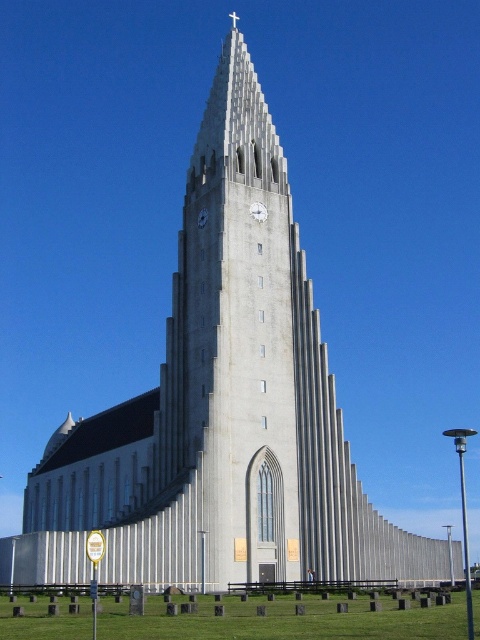
Question: Which of the following is the farthest from the observer?

Choices:
 (A) white glossy clock at center
 (B) white matte clock at center

Answer: (B)

Question: Is white glossy clock at center to the right of white matte clock at center from the viewer's perspective?

Choices:
 (A) no
 (B) yes

Answer: (B)

Question: Which of the following is the farthest from the observer?

Choices:
 (A) white glossy clock at center
 (B) white matte clock at center

Answer: (B)

Question: Is white glossy clock at center thinner than white matte clock at center?

Choices:
 (A) yes
 (B) no

Answer: (B)

Question: Where is white glossy clock at center located in relation to white matte clock at center in the image?

Choices:
 (A) above
 (B) below

Answer: (A)